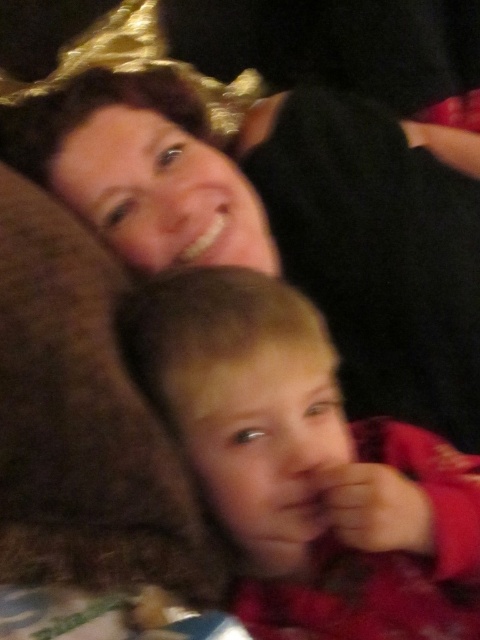
Question: Is matte black hair at upper center above smooth red shirt at lower center?

Choices:
 (A) no
 (B) yes

Answer: (B)

Question: Which object appears farthest from the camera in this image?

Choices:
 (A) smooth red shirt at lower center
 (B) matte black hair at upper center

Answer: (B)

Question: Is matte black hair at upper center closer to the viewer compared to smooth red shirt at lower center?

Choices:
 (A) yes
 (B) no

Answer: (B)

Question: Can you confirm if matte black hair at upper center is thinner than smooth red shirt at lower center?

Choices:
 (A) no
 (B) yes

Answer: (A)